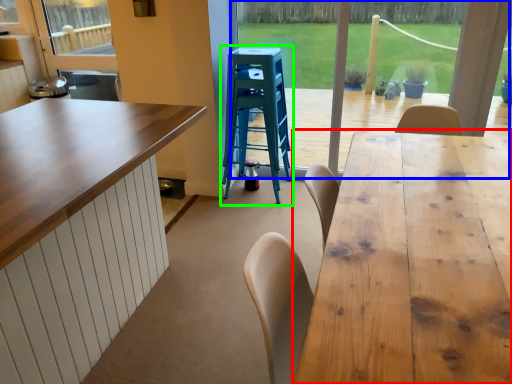
Question: Considering the real-world distances, which object is closest to table (highlighted by a red box)? window frame (highlighted by a blue box) or step stool (highlighted by a green box).

Choices:
 (A) window frame
 (B) step stool

Answer: (B)